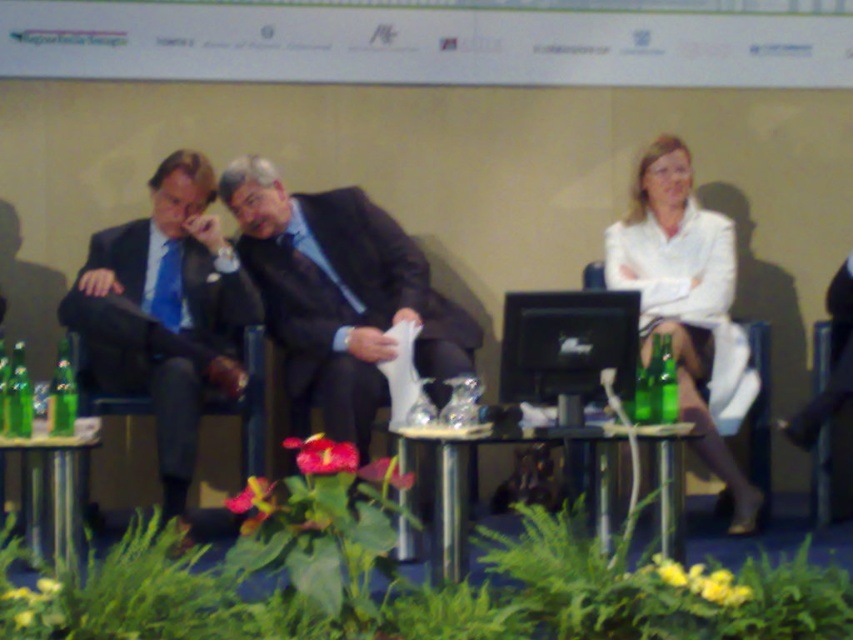
Is point (20, 499) positioned behind point (16, 420)?

Yes, it is.

Does metallic silver table at lower left lie in front of green glass bottle at lower left?

Yes, it is in front of green glass bottle at lower left.

You are a GUI agent. You are given a task and a screenshot of the screen. Output one action in this format:
    pyautogui.click(x=<x>, y=<y>)
    Task: Click on the metallic silver table at lower left
    This screenshot has width=853, height=640.
    Given the screenshot: What is the action you would take?
    pyautogui.click(x=53, y=490)

Between white matte blazer at upper right and green glass bottle at left, which one is positioned lower?

green glass bottle at left

Can you confirm if white matte blazer at upper right is thinner than green glass bottle at left?

No, white matte blazer at upper right is not thinner than green glass bottle at left.

Which is in front, point (688, 390) or point (71, 420)?

Positioned in front is point (71, 420).

Locate an element on the screen. white matte blazer at upper right is located at coordinates [x=689, y=307].

Can you confirm if dark suit at center is taller than clear glass table at center?

Correct, dark suit at center is much taller as clear glass table at center.

I want to click on dark suit at center, so click(339, 296).

Does point (434, 305) come farther from viewer compared to point (674, 534)?

Yes.

Locate an element on the screen. The width and height of the screenshot is (853, 640). dark suit at center is located at coordinates (339, 296).